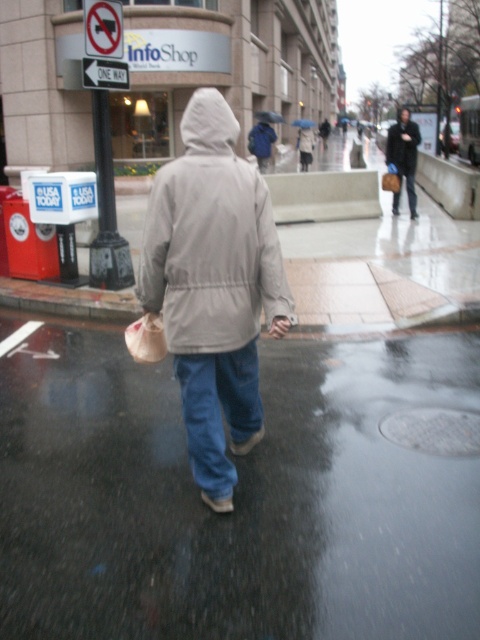
You are a pedestrian trying to find the nearest coffee shop. You see a point marked at coordinates (404, 156). What object is located there?

The point at coordinates (404, 156) indicates the dark brown leather jacket at upper right.

You are a fashion designer observing two coats in an urban setting. The light gray matte jacket at center and the matte gray coat at center are both in your view. Which one has a larger size according to their appearance?

The matte gray coat at center is larger than the light gray matte jacket at center.

You are a pedestrian trying to stay dry in the rain. You see a light gray matte jacket at center and a black matte umbrella at upper center. Which object is larger and could potentially provide better rain protection?

The black matte umbrella at upper center is larger than the light gray matte jacket at center, so it could provide better rain protection.